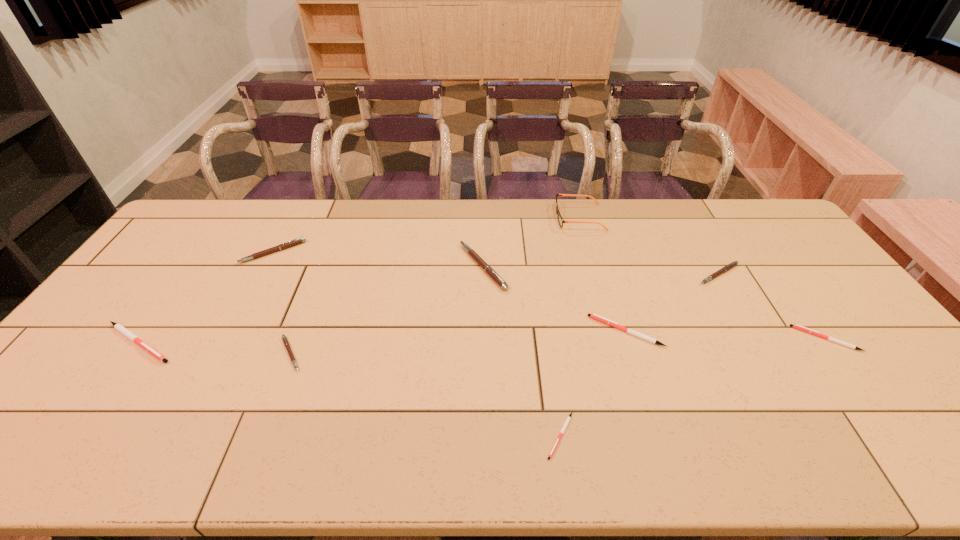
In the image, there is a desktop. Where is `free region at the right edge`? Image resolution: width=960 pixels, height=540 pixels. free region at the right edge is located at coordinates [x=897, y=367].

Where is `vacant region at the far right corner`? The height and width of the screenshot is (540, 960). vacant region at the far right corner is located at coordinates pos(732,199).

I want to click on vacant region between the eighth object from right to left and the second biggest white pen, so click(x=449, y=292).

The image size is (960, 540). Identify the location of vacant space in between the second smallest white pen and the leftmost object. (482, 341).

Image resolution: width=960 pixels, height=540 pixels. Find the location of `vacant point located between the leftmost pink pen and the nearest white pen`. vacant point located between the leftmost pink pen and the nearest white pen is located at coordinates (417, 343).

Locate an element on the screen. vacant region between the tallest pen and the farthest object is located at coordinates (531, 242).

Locate an element on the screen. The width and height of the screenshot is (960, 540). unoccupied area between the third smallest pink pen and the tallest object is located at coordinates (426, 235).

Find the location of a particular element. The height and width of the screenshot is (540, 960). free spot between the second biggest pink pen and the rightmost pen is located at coordinates (549, 295).

Find the location of `empty space that is in between the leftmost pen and the third smallest white pen`. empty space that is in between the leftmost pen and the third smallest white pen is located at coordinates (382, 337).

The height and width of the screenshot is (540, 960). I want to click on empty space between the third object from left to right and the second pen from left to right, so click(x=281, y=303).